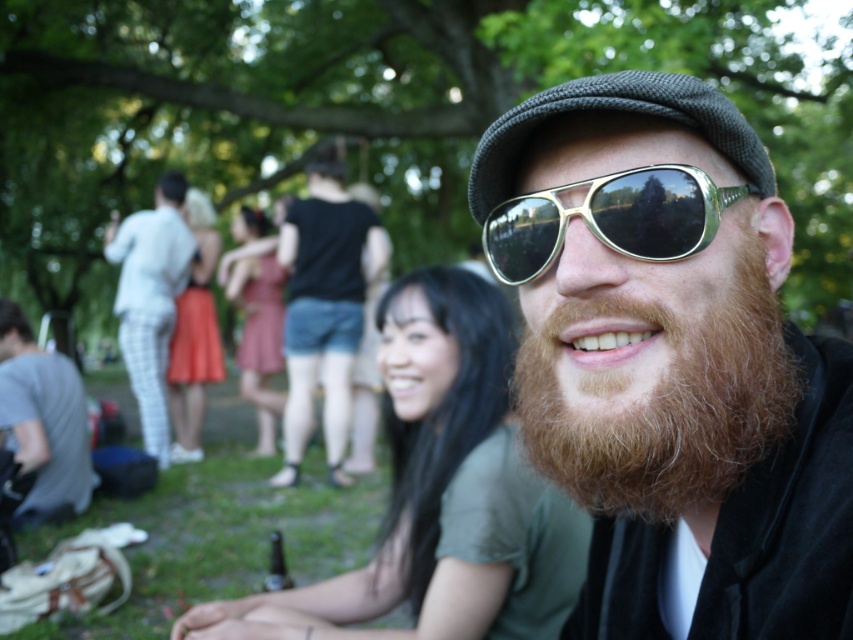
You are a photographer adjusting your camera settings to focus on the reddish brown fuzzy beard at center. The camera can only focus on objects within a 0.1 unit radius around a selected point. Would selecting the point at coordinates (663, 401) ensure the beard is in focus?

The reddish brown fuzzy beard at center is represented by point (663, 401). Since the camera can focus within a 0.1 unit radius around the selected point, selecting that exact coordinate would place the beard within the focus range, ensuring it is in focus.

In the scene shown: You are taking a photo of two people in a park. You want to ensure both are in focus. The camera focuses on the person at point [732,330] first. Will the person at point [529,220] also be in focus?

Point [732,330] is in front of point [529,220], so if the camera focuses on the person at point [732,330] first, the person at point [529,220] may not be in focus because they are further away from the camera.